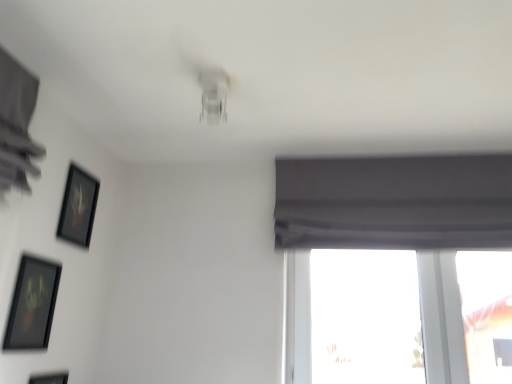
Question: Relative to matte black picture frame at lower left, which ranks as the first picture frame in bottom-to-top order, is black matte picture frame at upper left, which is the third picture frame from bottom to top, in front or behind?

Choices:
 (A) behind
 (B) front

Answer: (A)

Question: Is point (71, 223) closer or farther from the camera than point (48, 374)?

Choices:
 (A) closer
 (B) farther

Answer: (B)

Question: Which is farther from the black matte picture frame at upper left, the 1th picture frame from the top?

Choices:
 (A) matte black picture frame at lower left, which is counted as the second picture frame, starting from the top
 (B) matte black picture frame at lower left, which ranks as the 3th picture frame in top-to-bottom order
 (C) gray matte curtain at upper right
 (D) transparent glass window at lower right

Answer: (D)

Question: Estimate the real-world distances between objects in this image. Which object is farther from the matte black picture frame at lower left, which ranks as the 3th picture frame in top-to-bottom order?

Choices:
 (A) gray matte curtain at upper right
 (B) transparent glass window at lower right
 (C) black matte picture frame at upper left, the 1th picture frame from the top
 (D) matte black picture frame at lower left, which is the second picture frame from bottom to top

Answer: (A)